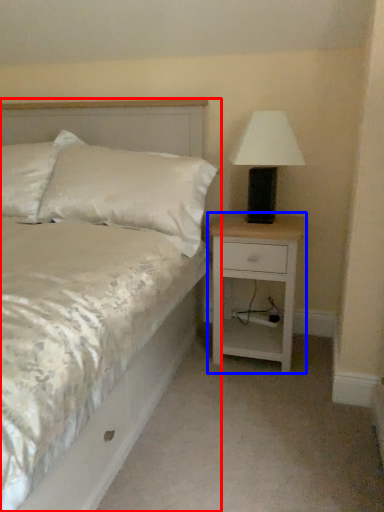
Question: Which object is closer to the camera taking this photo, bed (highlighted by a red box) or nightstand (highlighted by a blue box)?

Choices:
 (A) bed
 (B) nightstand

Answer: (A)